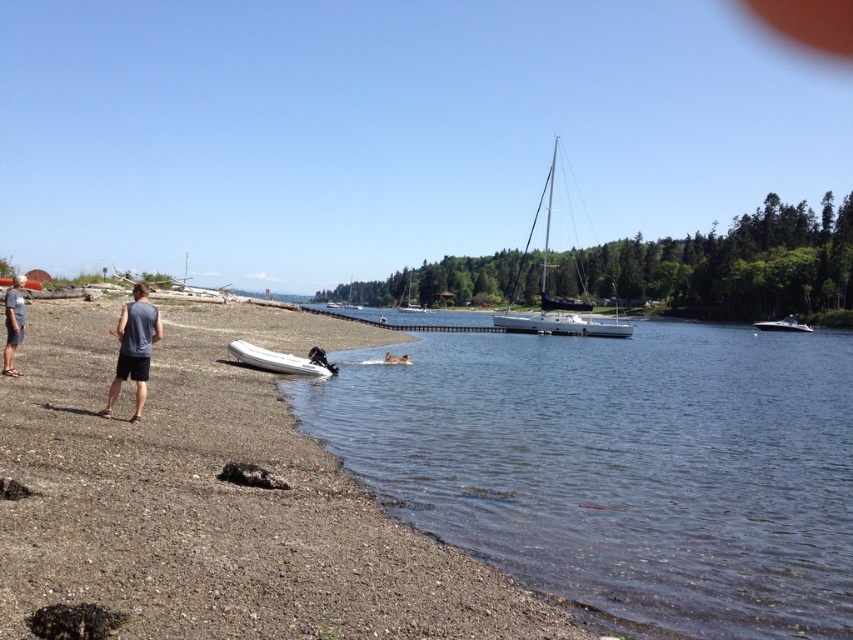
You are standing on the sandy shoreline and see the point marked at coordinates (554, 298). Based on the scene description, where is this point located?

The point marked at coordinates (554, 298) is located on the white glossy sailboat at center.

You are planning to dock a new boat at the lakeside. The dock can only accommodate boats up to 3 meters in width. Based on the scene, which boat between the white glossy sailboat at center and the white matte boat at center is more likely to fit on the dock?

The white glossy sailboat at center might be wider than white matte boat at center, so the white matte boat at center is more likely to fit on the dock since it is narrower.

You are standing at the lakeside and want to hand a life jacket to the gray fabric shirt at lower left. If you can throw the jacket 40 feet, will you be able to reach them?

The gray fabric shirt at lower left is 42.01 feet away from the viewer. Since the throwing distance is 40 feet, you cannot reach them with a single throw.